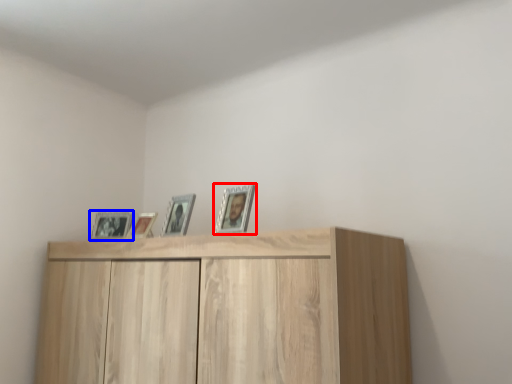
Question: Which object is further to the camera taking this photo, picture frame (highlighted by a red box) or picture frame (highlighted by a blue box)?

Choices:
 (A) picture frame
 (B) picture frame

Answer: (B)